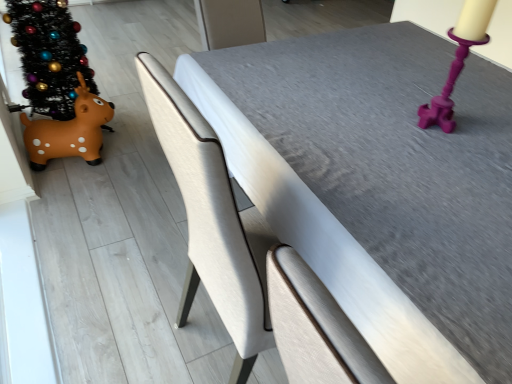
Describe the element at coordinates (49, 55) in the screenshot. I see `black glittery christmas tree at left` at that location.

I want to click on purple plastic candle holder at upper right, so click(x=447, y=89).

Locate an element on the screen. textured gray table at center is located at coordinates (379, 185).

You are a GUI agent. You are given a task and a screenshot of the screen. Output one action in this format:
    pyautogui.click(x=<x>, y=<y>)
    Task: Click on the toy below the black glittery christmas tree at left (from the image's perspective)
    This screenshot has height=384, width=512.
    Given the screenshot: What is the action you would take?
    pyautogui.click(x=69, y=131)

In the scene shown: Considering the relative sizes of black glittery christmas tree at left and brown rubber toy at left in the image provided, is black glittery christmas tree at left smaller than brown rubber toy at left?

Actually, black glittery christmas tree at left might be larger than brown rubber toy at left.

Considering the positions of objects black glittery christmas tree at left and brown rubber toy at left in the image provided, who is more to the right, black glittery christmas tree at left or brown rubber toy at left?

Positioned to the right is brown rubber toy at left.

How distant is black glittery christmas tree at left from brown rubber toy at left?

6.49 inches.

Is textured gray table at center facing away from black glittery christmas tree at left?

No.

From the image's perspective, which is above, textured gray table at center or black glittery christmas tree at left?

black glittery christmas tree at left.

Considering the points (243, 110) and (46, 114), which point is in front, point (243, 110) or point (46, 114)?

Positioned in front is point (243, 110).

Does brown rubber toy at left turn towards black glittery christmas tree at left?

No, brown rubber toy at left is not oriented towards black glittery christmas tree at left.

In the scene shown: Is brown rubber toy at left at the right side of black glittery christmas tree at left?

Yes.

Which object is closer to the camera, brown rubber toy at left or black glittery christmas tree at left?

black glittery christmas tree at left is closer to the camera.

From the image's perspective, is brown rubber toy at left on black glittery christmas tree at left?

No, from the image's perspective, brown rubber toy at left is not over black glittery christmas tree at left.

Does purple plastic candle holder at upper right have a larger size compared to brown rubber toy at left?

No, purple plastic candle holder at upper right is not bigger than brown rubber toy at left.

From the image's perspective, relative to brown rubber toy at left, is purple plastic candle holder at upper right above or below?

From the image's perspective, purple plastic candle holder at upper right appears above brown rubber toy at left.

Can you confirm if purple plastic candle holder at upper right is positioned to the right of brown rubber toy at left?

Indeed, purple plastic candle holder at upper right is positioned on the right side of brown rubber toy at left.

Is the depth of purple plastic candle holder at upper right less than that of brown rubber toy at left?

Yes.

Is point (30, 12) farther from viewer compared to point (475, 267)?

Yes, it is.

Is the surface of black glittery christmas tree at left in direct contact with textured gray table at center?

No, black glittery christmas tree at left is not next to textured gray table at center.

From a real-world perspective, which is physically above, black glittery christmas tree at left or textured gray table at center?

black glittery christmas tree at left.

The image size is (512, 384). What are the coordinates of `table below the black glittery christmas tree at left (from the image's perspective)` in the screenshot? It's located at (379, 185).

Is purple plastic candle holder at upper right inside or outside of textured gray table at center?

purple plastic candle holder at upper right is spatially situated outside textured gray table at center.

Identify the location of table in front of the purple plastic candle holder at upper right. This screenshot has width=512, height=384. (379, 185).

Who is shorter, purple plastic candle holder at upper right or textured gray table at center?

purple plastic candle holder at upper right is shorter.

Is brown rubber toy at left positioned with its back to textured gray table at center?

brown rubber toy at left is not turned away from textured gray table at center.

How different are the orientations of brown rubber toy at left and textured gray table at center in degrees?

There is a 3.14-degree angle between the facing directions of brown rubber toy at left and textured gray table at center.

Is brown rubber toy at left wider or thinner than textured gray table at center?

In the image, brown rubber toy at left appears to be more narrow than textured gray table at center.

Identify the location of toy that is under the textured gray table at center (from a real-world perspective). (69, 131).

Locate an element on the screen. The image size is (512, 384). christmas tree above the brown rubber toy at left (from the image's perspective) is located at coordinates (49, 55).

What are the coordinates of `christmas tree on the left of textured gray table at center` in the screenshot? It's located at (49, 55).

From the picture: From the image, which object appears to be nearer to textured gray table at center, black glittery christmas tree at left or purple plastic candle holder at upper right?

purple plastic candle holder at upper right.

Considering their positions, is purple plastic candle holder at upper right positioned further to brown rubber toy at left than textured gray table at center?

purple plastic candle holder at upper right lies further to brown rubber toy at left than the other object.

When comparing their distances from purple plastic candle holder at upper right, does textured gray table at center or brown rubber toy at left seem further?

The object further to purple plastic candle holder at upper right is brown rubber toy at left.

Which object lies nearer to the anchor point black glittery christmas tree at left, textured gray table at center or brown rubber toy at left?

The object closer to black glittery christmas tree at left is brown rubber toy at left.

Which object lies nearer to the anchor point textured gray table at center, brown rubber toy at left or purple plastic candle holder at upper right?

Among the two, purple plastic candle holder at upper right is located nearer to textured gray table at center.

Based on their spatial positions, is brown rubber toy at left or black glittery christmas tree at left closer to textured gray table at center?

brown rubber toy at left.

Estimate the real-world distances between objects in this image. Which object is closer to purple plastic candle holder at upper right, brown rubber toy at left or black glittery christmas tree at left?

brown rubber toy at left.

Based on their spatial positions, is textured gray table at center or purple plastic candle holder at upper right closer to brown rubber toy at left?

Based on the image, textured gray table at center appears to be nearer to brown rubber toy at left.

Image resolution: width=512 pixels, height=384 pixels. I want to click on table between black glittery christmas tree at left and purple plastic candle holder at upper right from left to right, so 379,185.

At what (x,y) coordinates should I click in order to perform the action: click on table located between brown rubber toy at left and purple plastic candle holder at upper right in the left-right direction. Please return your answer as a coordinate pair (x, y). Looking at the image, I should click on (379, 185).

Locate an element on the screen. toy between black glittery christmas tree at left and textured gray table at center in the horizontal direction is located at coordinates (69, 131).

At what (x,y) coordinates should I click in order to perform the action: click on toy between black glittery christmas tree at left and purple plastic candle holder at upper right from left to right. Please return your answer as a coordinate pair (x, y). The width and height of the screenshot is (512, 384). Looking at the image, I should click on (69, 131).